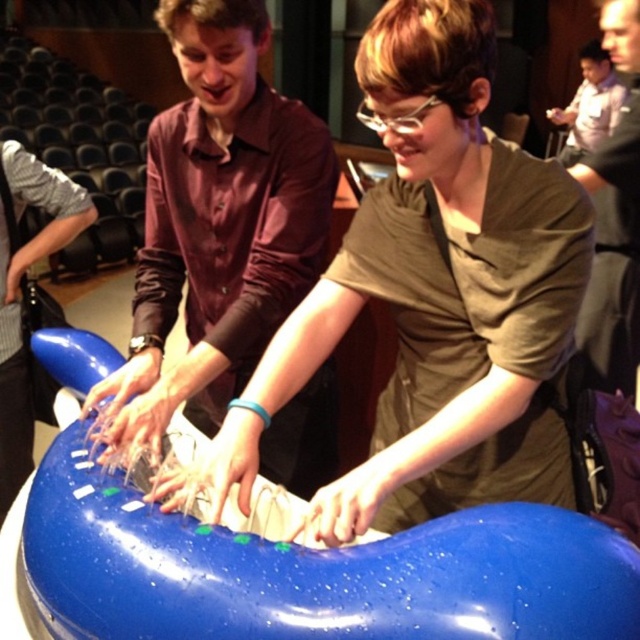
Question: Which point appears farthest from the camera in this image?

Choices:
 (A) coord(228,324)
 (B) coord(556,115)

Answer: (B)

Question: Is matte black shirt at upper right above light blue plastic toy at upper right?

Choices:
 (A) no
 (B) yes

Answer: (A)

Question: Which of these objects is positioned farthest from the matte black shirt at upper right?

Choices:
 (A) matte brown shirt at center
 (B) light blue plastic toy at upper right

Answer: (B)

Question: Considering the relative positions of glossy plastic object at center and matte black shirt at upper right in the image provided, where is glossy plastic object at center located with respect to matte black shirt at upper right?

Choices:
 (A) right
 (B) left

Answer: (B)

Question: Is matte brown shirt at center positioned behind matte black shirt at upper right?

Choices:
 (A) no
 (B) yes

Answer: (A)

Question: Which object is the closest to the matte black shirt at upper right?

Choices:
 (A) light blue plastic toy at upper right
 (B) matte brown shirt at center
 (C) glossy plastic object at center

Answer: (C)